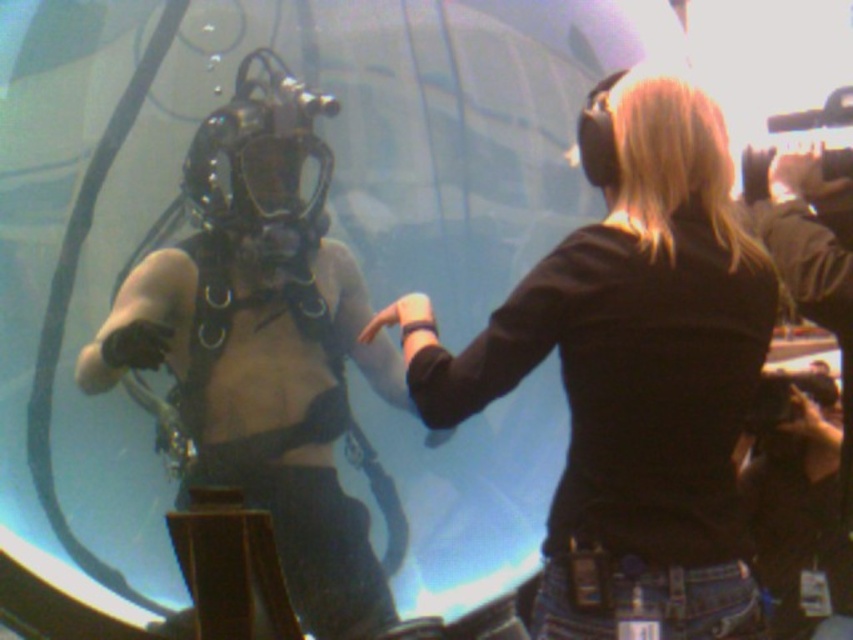
Question: Which point appears closest to the camera in this image?

Choices:
 (A) (747, 596)
 (B) (158, 330)

Answer: (B)

Question: Is black matte shirt at upper right to the right of metallic scuba gear at center from the viewer's perspective?

Choices:
 (A) no
 (B) yes

Answer: (B)

Question: Among these objects, which one is nearest to the camera?

Choices:
 (A) black matte shirt at upper right
 (B) metallic scuba gear at center

Answer: (B)

Question: From the image, what is the correct spatial relationship of black matte shirt at upper right in relation to metallic scuba gear at center?

Choices:
 (A) below
 (B) above

Answer: (B)

Question: Can you confirm if black matte shirt at upper right is positioned above metallic scuba gear at center?

Choices:
 (A) yes
 (B) no

Answer: (A)